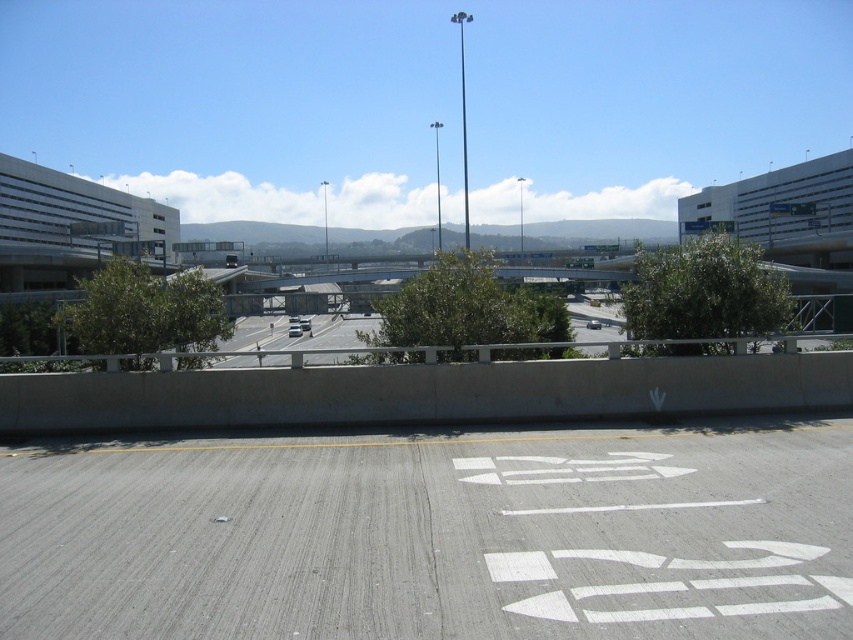
Which is more to the right, gray asphalt road at center or gray asphalt highway at center?

From the viewer's perspective, gray asphalt road at center appears more on the right side.

Which is behind, point (491, 580) or point (345, 320)?

The point (345, 320) is more distant.

Where is `gray asphalt road at center`? gray asphalt road at center is located at coordinates (434, 534).